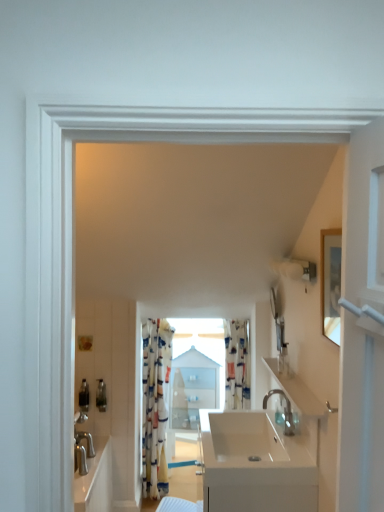
Question: Could you tell me if printed fabric curtain at center, which ranks as the first curtain in right-to-left order, is turned towards matte plastic soap dispenser at upper right, the 1th toiletry in the right-to-left sequence?

Choices:
 (A) yes
 (B) no

Answer: (A)

Question: Does printed fabric curtain at center, placed as the 2th curtain when sorted from left to right, have a smaller size compared to matte plastic soap dispenser at upper right, the 1th toiletry from the top?

Choices:
 (A) no
 (B) yes

Answer: (A)

Question: Is printed fabric curtain at center, which ranks as the first curtain in right-to-left order, not inside matte plastic soap dispenser at upper right, acting as the first toiletry starting from the front?

Choices:
 (A) yes
 (B) no

Answer: (A)

Question: From the image's perspective, is printed fabric curtain at center, which ranks as the first curtain in right-to-left order, located above matte plastic soap dispenser at upper right, acting as the first toiletry starting from the front?

Choices:
 (A) yes
 (B) no

Answer: (B)

Question: Would you consider printed fabric curtain at center, placed as the 2th curtain when sorted from left to right, to be distant from matte plastic soap dispenser at upper right, the 1th toiletry in the right-to-left sequence?

Choices:
 (A) yes
 (B) no

Answer: (B)

Question: In the image, is transparent glass window at center on the left side or the right side of white glossy sink at center?

Choices:
 (A) left
 (B) right

Answer: (A)

Question: Considering the positions of transparent glass window at center and white glossy sink at center in the image, is transparent glass window at center wider or thinner than white glossy sink at center?

Choices:
 (A) thin
 (B) wide

Answer: (A)

Question: Is transparent glass window at center inside or outside of white glossy sink at center?

Choices:
 (A) outside
 (B) inside

Answer: (A)

Question: From the image's perspective, relative to white glossy sink at center, is transparent glass window at center above or below?

Choices:
 (A) below
 (B) above

Answer: (B)

Question: Looking at their shapes, would you say glossy white mirror at upper right is wider or thinner than white glossy sink at center?

Choices:
 (A) wide
 (B) thin

Answer: (B)

Question: Which is correct: glossy white mirror at upper right is inside white glossy sink at center, or outside of it?

Choices:
 (A) outside
 (B) inside

Answer: (A)

Question: In terms of height, does glossy white mirror at upper right look taller or shorter compared to white glossy sink at center?

Choices:
 (A) short
 (B) tall

Answer: (A)

Question: Based on their sizes in the image, would you say glossy white mirror at upper right is bigger or smaller than white glossy sink at center?

Choices:
 (A) big
 (B) small

Answer: (B)

Question: From their relative heights in the image, would you say patterned fabric curtain at center, which ranks as the first curtain in left-to-right order, is taller or shorter than white glossy sink at center?

Choices:
 (A) tall
 (B) short

Answer: (A)

Question: Considering the positions of patterned fabric curtain at center, placed as the 2th curtain when sorted from right to left, and white glossy sink at center in the image, is patterned fabric curtain at center, placed as the 2th curtain when sorted from right to left, bigger or smaller than white glossy sink at center?

Choices:
 (A) big
 (B) small

Answer: (B)